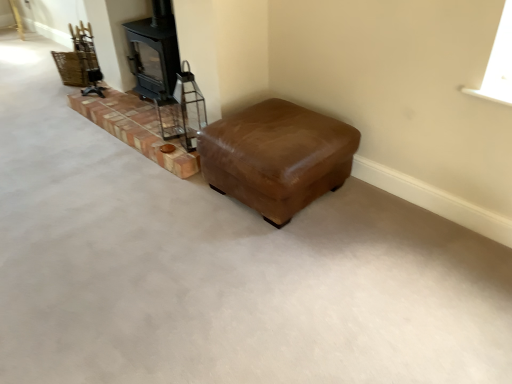
Question: Does brick at left have a lesser height compared to black matte wood burning stove at upper left?

Choices:
 (A) no
 (B) yes

Answer: (B)

Question: Can you confirm if brick at left is thinner than black matte wood burning stove at upper left?

Choices:
 (A) yes
 (B) no

Answer: (B)

Question: Considering the relative sizes of brick at left and black matte wood burning stove at upper left in the image provided, is brick at left bigger than black matte wood burning stove at upper left?

Choices:
 (A) yes
 (B) no

Answer: (B)

Question: Is the position of brick at left more distant than that of black matte wood burning stove at upper left?

Choices:
 (A) yes
 (B) no

Answer: (B)

Question: Does brick at left have a greater height compared to black matte wood burning stove at upper left?

Choices:
 (A) no
 (B) yes

Answer: (A)

Question: Based on their positions, is black matte wood burning stove at upper left located to the left or right of brick at left?

Choices:
 (A) right
 (B) left

Answer: (A)

Question: Do you think black matte wood burning stove at upper left is within brick at left, or outside of it?

Choices:
 (A) outside
 (B) inside

Answer: (A)

Question: From the image's perspective, relative to brick at left, is black matte wood burning stove at upper left above or below?

Choices:
 (A) above
 (B) below

Answer: (A)

Question: Based on their sizes in the image, would you say black matte wood burning stove at upper left is bigger or smaller than brick at left?

Choices:
 (A) big
 (B) small

Answer: (A)

Question: In terms of size, does black matte wood burning stove at upper left appear bigger or smaller than brown leather ottoman at center?

Choices:
 (A) big
 (B) small

Answer: (B)

Question: In terms of width, does black matte wood burning stove at upper left look wider or thinner when compared to brown leather ottoman at center?

Choices:
 (A) wide
 (B) thin

Answer: (B)

Question: From a real-world perspective, relative to brown leather ottoman at center, is black matte wood burning stove at upper left vertically above or below?

Choices:
 (A) below
 (B) above

Answer: (B)

Question: In terms of height, does black matte wood burning stove at upper left look taller or shorter compared to brown leather ottoman at center?

Choices:
 (A) short
 (B) tall

Answer: (B)

Question: Is point (159, 144) closer or farther from the camera than point (166, 24)?

Choices:
 (A) closer
 (B) farther

Answer: (B)

Question: Considering the positions of brick at left and black matte wood burning stove at upper left in the image, is brick at left bigger or smaller than black matte wood burning stove at upper left?

Choices:
 (A) big
 (B) small

Answer: (B)